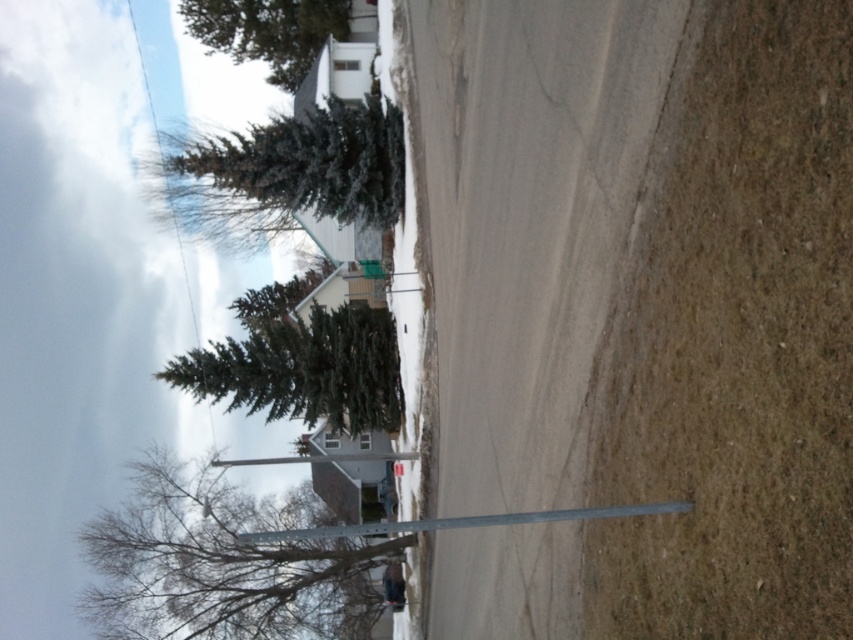
Between green matte evergreen tree at upper left and green textured pine tree at upper center, which one is positioned higher?

Positioned higher is green textured pine tree at upper center.

Is the position of green matte evergreen tree at upper left less distant than that of green textured pine tree at upper center?

Yes, green matte evergreen tree at upper left is in front of green textured pine tree at upper center.

Is point (277, 340) behind point (286, 38)?

No, it is in front of (286, 38).

Find the location of a particular element. The width and height of the screenshot is (853, 640). green matte evergreen tree at upper left is located at coordinates (300, 364).

Does point (138, 516) come farther from viewer compared to point (343, 330)?

Yes, it is behind point (343, 330).

Is green textured evergreen at upper left to the left of green matte evergreen tree at upper left from the viewer's perspective?

Incorrect, green textured evergreen at upper left is not on the left side of green matte evergreen tree at upper left.

Locate an element on the screen. green textured evergreen at upper left is located at coordinates (223, 563).

Where is `green textured evergreen at upper left`? Image resolution: width=853 pixels, height=640 pixels. green textured evergreen at upper left is located at coordinates (223, 563).

Does green textured pine tree at upper center have a smaller size compared to black matte skier at center?

No, green textured pine tree at upper center is not smaller than black matte skier at center.

Is green textured pine tree at upper center shorter than black matte skier at center?

In fact, green textured pine tree at upper center may be taller than black matte skier at center.

Is point (303, 24) positioned in front of point (393, 563)?

That is False.

Locate an element on the screen. green textured pine tree at upper center is located at coordinates (268, 32).